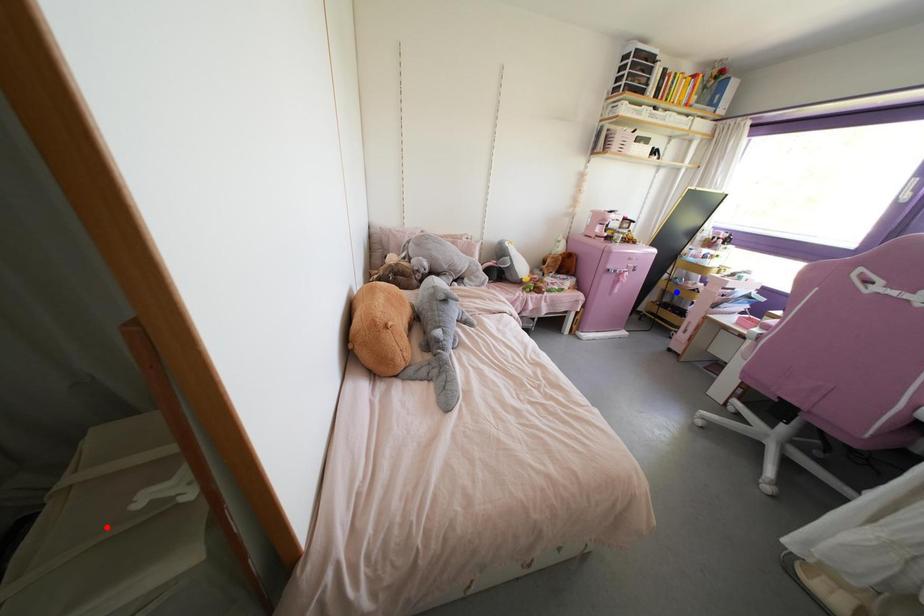
Question: Which of the two points in the image is closer to the camera?

Choices:
 (A) Blue point is closer.
 (B) Red point is closer.

Answer: (B)